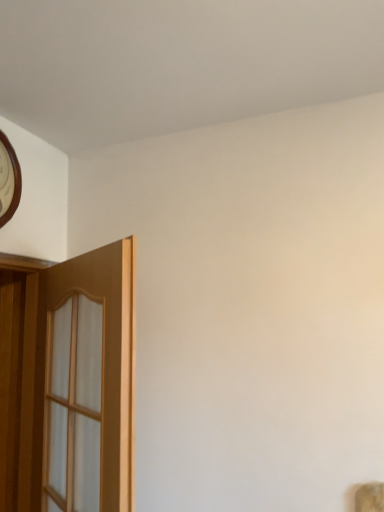
Question: From the image's perspective, is wooden clock at upper left located above or below wooden door at left?

Choices:
 (A) above
 (B) below

Answer: (A)

Question: In terms of height, does wooden clock at upper left look taller or shorter compared to wooden door at left?

Choices:
 (A) tall
 (B) short

Answer: (B)

Question: From a real-world perspective, is wooden clock at upper left above or below wooden door at left?

Choices:
 (A) below
 (B) above

Answer: (B)

Question: In terms of width, does wooden door at left look wider or thinner when compared to wooden clock at upper left?

Choices:
 (A) thin
 (B) wide

Answer: (B)

Question: Is point (21, 433) closer or farther from the camera than point (4, 204)?

Choices:
 (A) farther
 (B) closer

Answer: (A)

Question: Based on their positions, is wooden door at left located to the left or right of wooden clock at upper left?

Choices:
 (A) right
 (B) left

Answer: (A)

Question: Is wooden door at left in front of or behind wooden clock at upper left in the image?

Choices:
 (A) behind
 (B) front

Answer: (B)